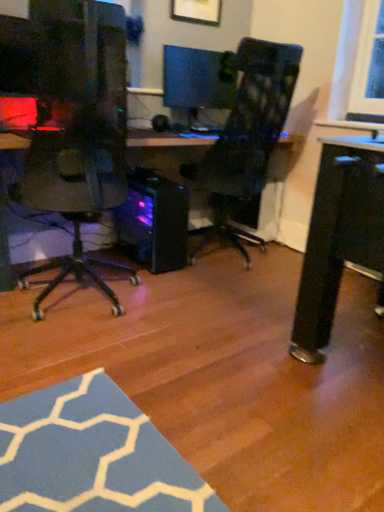
Where is `blank space situated above transparent plastic computer tower at center (from a real-world perspective)`? blank space situated above transparent plastic computer tower at center (from a real-world perspective) is located at coordinates (153, 180).